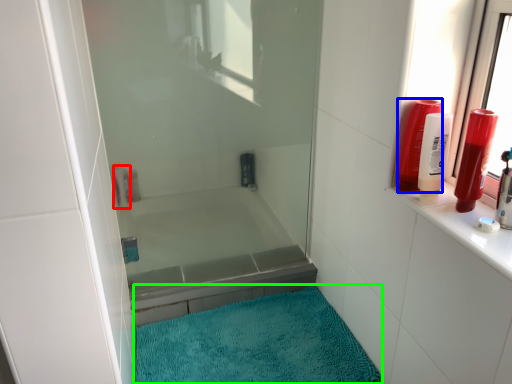
Question: Which is nearer to the toiletry (highlighted by a red box)? toiletry (highlighted by a blue box) or bath mat (highlighted by a green box).

Choices:
 (A) toiletry
 (B) bath mat

Answer: (B)